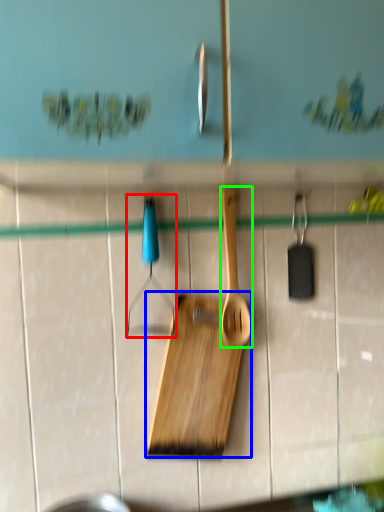
Question: Which is farther away from hanger (highlighted by a red box)? cutting board (highlighted by a blue box) or spatula (highlighted by a green box)?

Choices:
 (A) cutting board
 (B) spatula

Answer: (A)